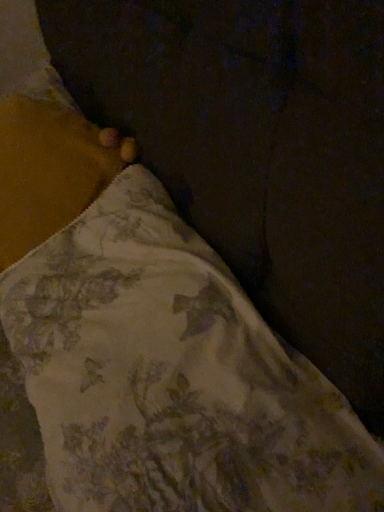
At what (x,y) coordinates should I click in order to perform the action: click on floral fabric at center. Please return your answer as a coordinate pair (x, y). This screenshot has width=384, height=512. Looking at the image, I should click on (162, 380).

What do you see at coordinates (162, 380) in the screenshot? This screenshot has width=384, height=512. I see `floral fabric at center` at bounding box center [162, 380].

The width and height of the screenshot is (384, 512). What are the coordinates of `floral fabric at center` in the screenshot? It's located at (162, 380).